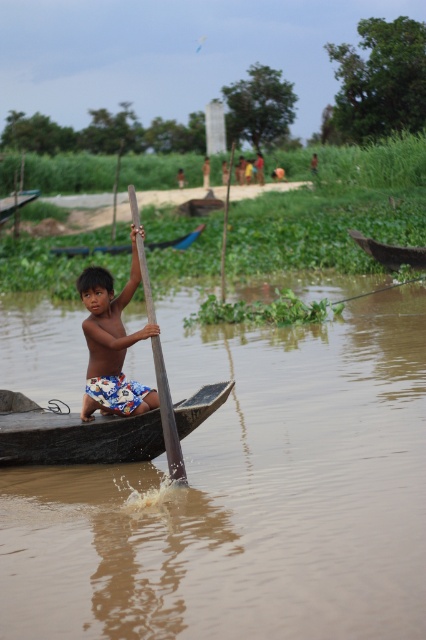
Question: Which point is closer to the camera?

Choices:
 (A) (238, 627)
 (B) (164, 387)
 (C) (60, 253)
 (D) (101, 452)

Answer: (A)

Question: Is shiny blue shorts at center further to camera compared to blue fabric boat at center?

Choices:
 (A) no
 (B) yes

Answer: (A)

Question: Which of these objects is positioned closest to the wooden smooth paddle at center?

Choices:
 (A) brown wooden boat at right
 (B) brown wooden boat at center

Answer: (B)

Question: Does shiny blue shorts at center have a lesser width compared to blue fabric boat at center?

Choices:
 (A) yes
 (B) no

Answer: (A)

Question: Observing the image, what is the correct spatial positioning of dark brown wood canoe at center in reference to brown wooden boat at right?

Choices:
 (A) right
 (B) left

Answer: (B)

Question: Which point is farther to the camera?

Choices:
 (A) (103, 422)
 (B) (391, 262)
 (C) (126, 522)

Answer: (B)